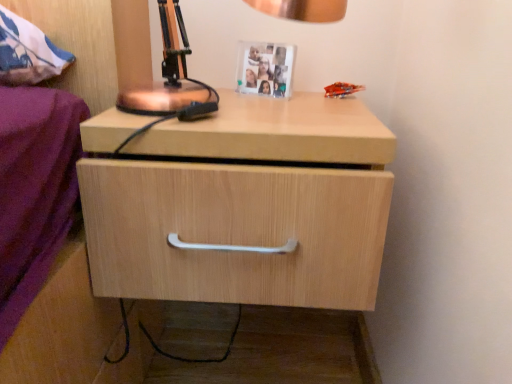
Locate an element on the screen. The image size is (512, 384). free point below copper metallic table lamp at upper center (from a real-world perspective) is located at coordinates (231, 120).